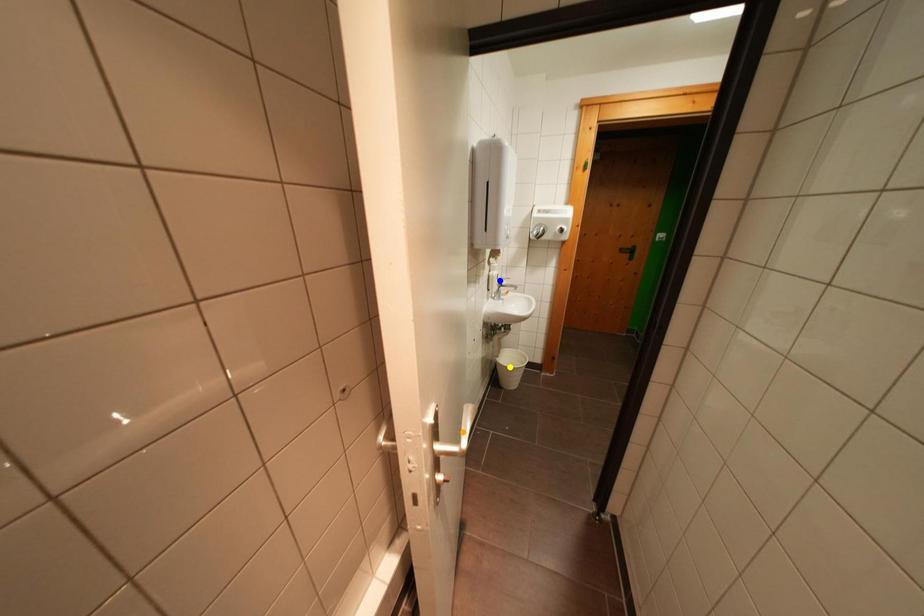
Order these from farthest to nearest:
1. orange point
2. yellow point
3. blue point

1. yellow point
2. blue point
3. orange point